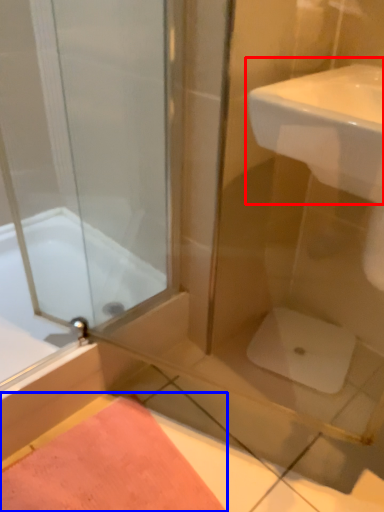
Question: Which object is closer to the camera taking this photo, sink (highlighted by a red box) or bath mat (highlighted by a blue box)?

Choices:
 (A) sink
 (B) bath mat

Answer: (A)